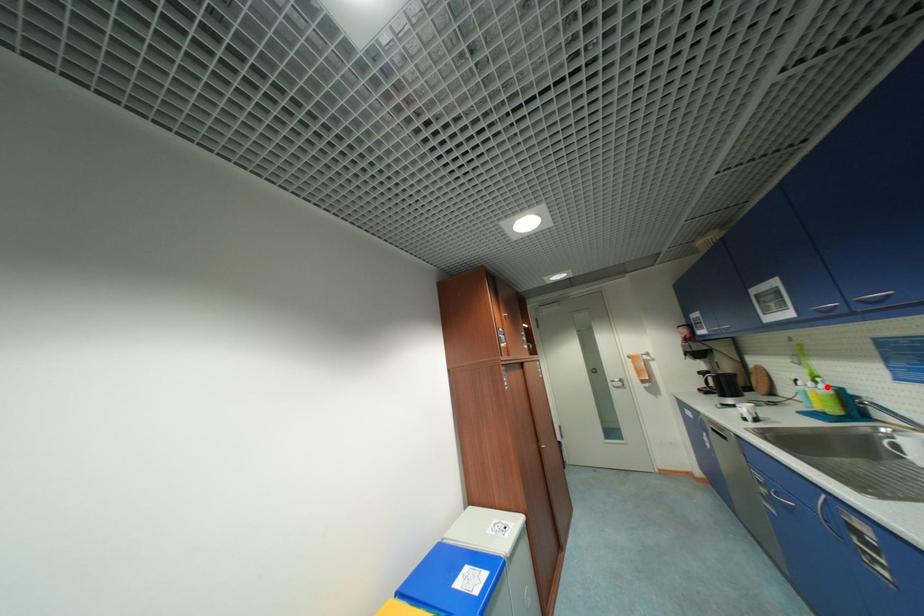
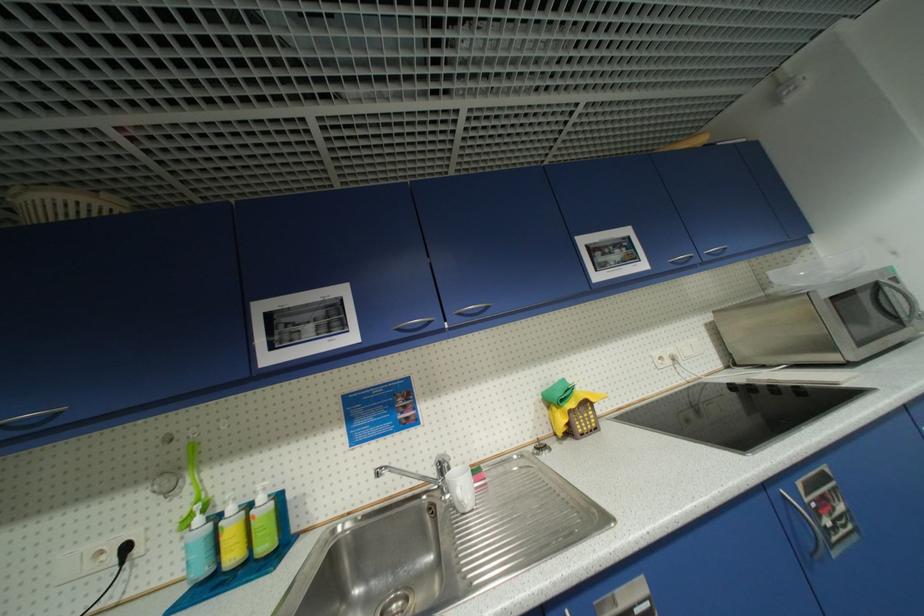
Question: I am providing you with two images of the same scene from different viewpoints. A red point is marked on the first image. At the location where the point appears in image 1, is it still visible in image 2?

Choices:
 (A) Yes
 (B) No

Answer: (A)